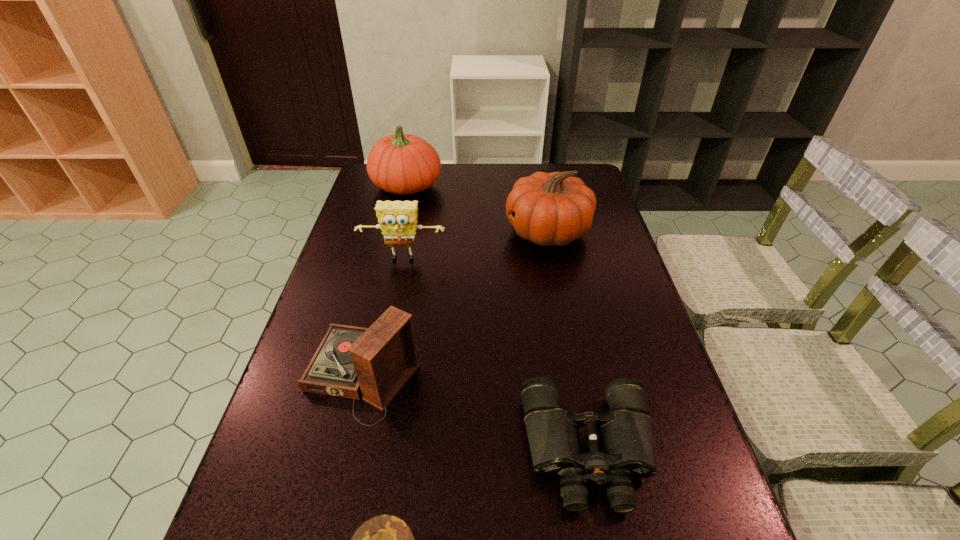
Locate an element on the screen. The width and height of the screenshot is (960, 540). the farther pumpkin is located at coordinates (404, 164).

Identify the location of the left pumpkin. The image size is (960, 540). (404, 164).

Where is `the nearer pumpkin`? the nearer pumpkin is located at coordinates (549, 209).

Identify the location of sponge. (397, 219).

What are the coordinates of `phonograph record` in the screenshot? It's located at click(x=376, y=362).

Find the location of a particular element. the shortest object is located at coordinates (625, 436).

What are the coordinates of `free region located 0.190m on the front of the farther pumpkin` in the screenshot? It's located at (395, 238).

The width and height of the screenshot is (960, 540). Find the location of `free location located 0.350m on the face of the nearer pumpkin`. free location located 0.350m on the face of the nearer pumpkin is located at coordinates (397, 232).

Find the location of a particular element. Image resolution: width=960 pixels, height=540 pixels. free space located on the face of the nearer pumpkin is located at coordinates (480, 232).

Where is `vacant region located 0.320m on the face of the nearer pumpkin`? vacant region located 0.320m on the face of the nearer pumpkin is located at coordinates (407, 232).